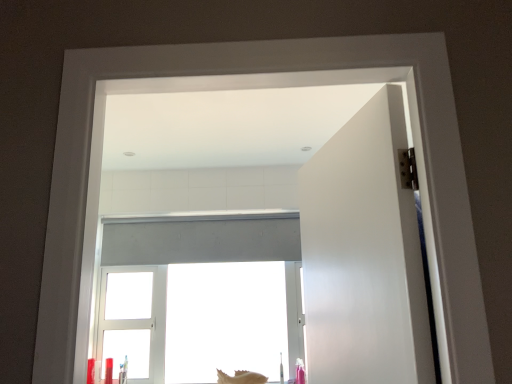
Question: Considering their positions, is smooth beige seashell at lower center located in front of or behind white matte window at center?

Choices:
 (A) behind
 (B) front

Answer: (B)

Question: Is smooth beige seashell at lower center bigger or smaller than white matte window at center?

Choices:
 (A) big
 (B) small

Answer: (B)

Question: Estimate the real-world distances between objects in this image. Which object is farther from the white matte window at center?

Choices:
 (A) white matte door at right
 (B) smooth beige seashell at lower center

Answer: (A)

Question: Estimate the real-world distances between objects in this image. Which object is closer to the smooth beige seashell at lower center?

Choices:
 (A) white matte door at right
 (B) white matte window at center

Answer: (B)